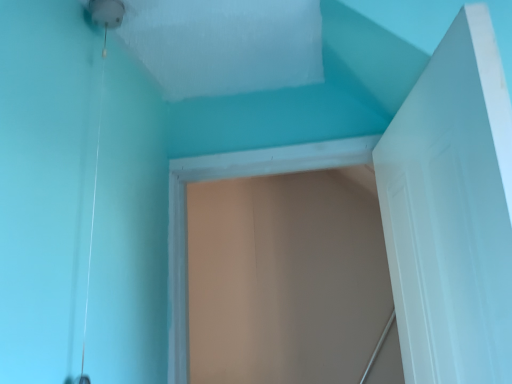
The width and height of the screenshot is (512, 384). What do you see at coordinates (452, 211) in the screenshot? I see `white smooth door at right` at bounding box center [452, 211].

The image size is (512, 384). Identify the location of white smooth door at right. (452, 211).

Measure the distance between white smooth door at right and camera.

The depth of white smooth door at right is 22.25 inches.

Find the location of a particular element. Image resolution: width=512 pixels, height=384 pixels. white smooth door at right is located at coordinates (452, 211).